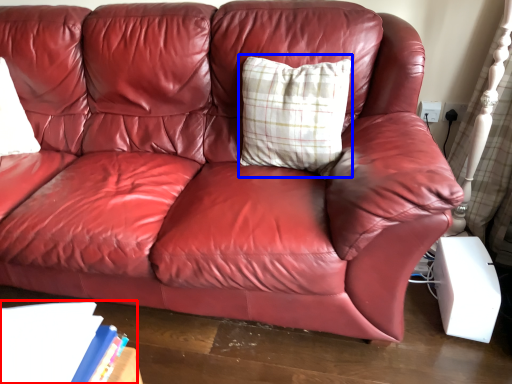
Question: Among these objects, which one is nearest to the camera, book (highlighted by a red box) or pillow (highlighted by a blue box)?

Choices:
 (A) book
 (B) pillow

Answer: (A)